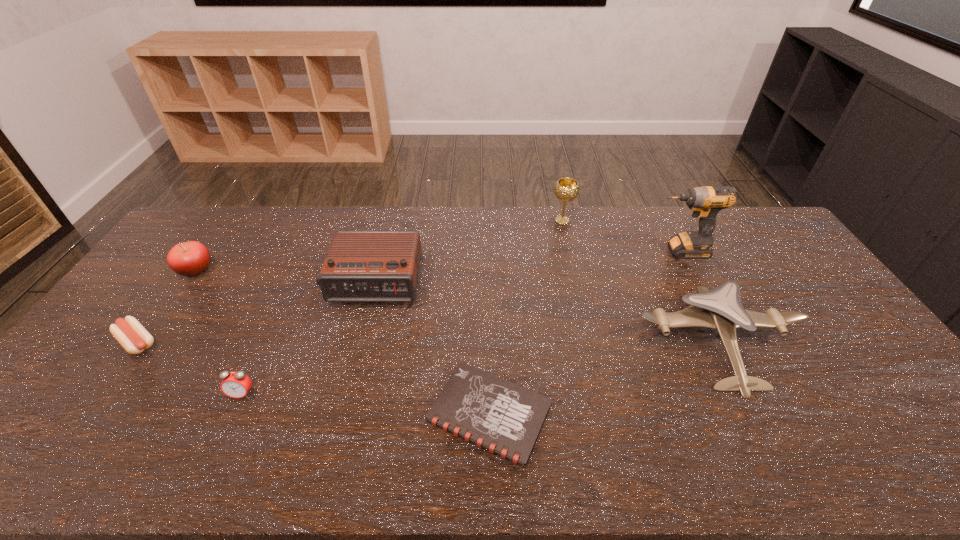
Identify the location of the tallest object. (706, 202).

At what (x,y) coordinates should I click in order to perform the action: click on chalice. Please return your answer as a coordinate pair (x, y). Looking at the image, I should click on (566, 189).

Where is `the farthest object`? The height and width of the screenshot is (540, 960). the farthest object is located at coordinates (566, 189).

Locate an element on the screen. Image resolution: width=960 pixels, height=540 pixels. the fifth object from right to left is located at coordinates (361, 266).

Identify the location of apple. (191, 258).

At what (x,y) coordinates should I click in order to perform the action: click on drone. Please return your answer as a coordinate pair (x, y). Looking at the image, I should click on (721, 308).

I want to click on the third shortest object, so click(235, 384).

Where is `the sixth object from right to left`? This screenshot has height=540, width=960. the sixth object from right to left is located at coordinates (235, 384).

This screenshot has height=540, width=960. Identify the location of sausage. (133, 337).

Where is `notebook`? Image resolution: width=960 pixels, height=540 pixels. notebook is located at coordinates (502, 417).